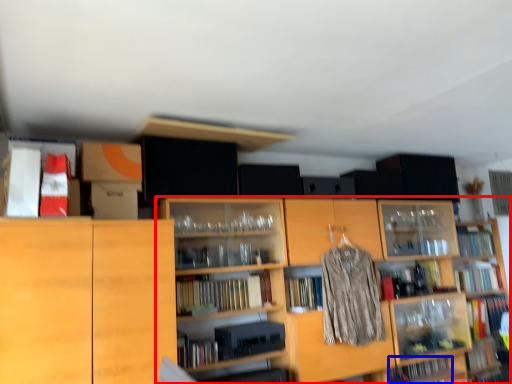
Question: Among these objects, which one is nearest to the camera, shelf (highlighted by a red box) or book (highlighted by a blue box)?

Choices:
 (A) shelf
 (B) book

Answer: (A)